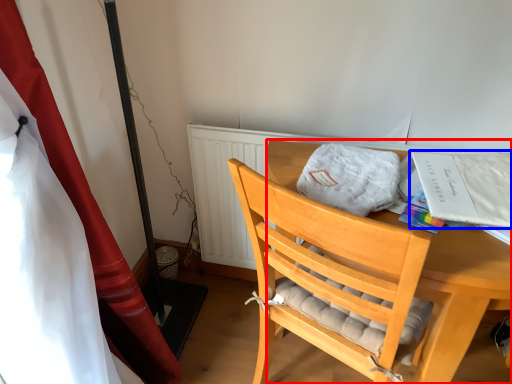
Question: Among these objects, which one is farthest to the camera, desk (highlighted by a red box) or magazine (highlighted by a blue box)?

Choices:
 (A) desk
 (B) magazine

Answer: (B)